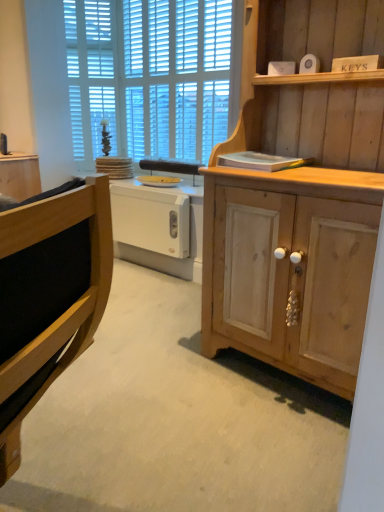
Question: From a real-world perspective, is white plastic radiator at center positioned above or below natural wood cabinet at right, the 2th cabinetry from the back?

Choices:
 (A) above
 (B) below

Answer: (B)

Question: From the image's perspective, relative to natural wood cabinet at right, the first cabinetry when ordered from right to left, is white plastic radiator at center above or below?

Choices:
 (A) above
 (B) below

Answer: (A)

Question: Estimate the real-world distances between objects in this image. Which object is farther from the white plastic drawer at center?

Choices:
 (A) white wooden blinds at upper center
 (B) wooden cabinet at left, which ranks as the first cabinetry in left-to-right order
 (C) white plastic radiator at center
 (D) natural wood cabinet at right, the 1th cabinetry when ordered from front to back

Answer: (D)

Question: Which object is the farthest from the wooden cabinet at left, which ranks as the first cabinetry in left-to-right order?

Choices:
 (A) white plastic radiator at center
 (B) white plastic drawer at center
 (C) natural wood cabinet at right, which is counted as the second cabinetry, starting from the left
 (D) white wooden blinds at upper center

Answer: (C)